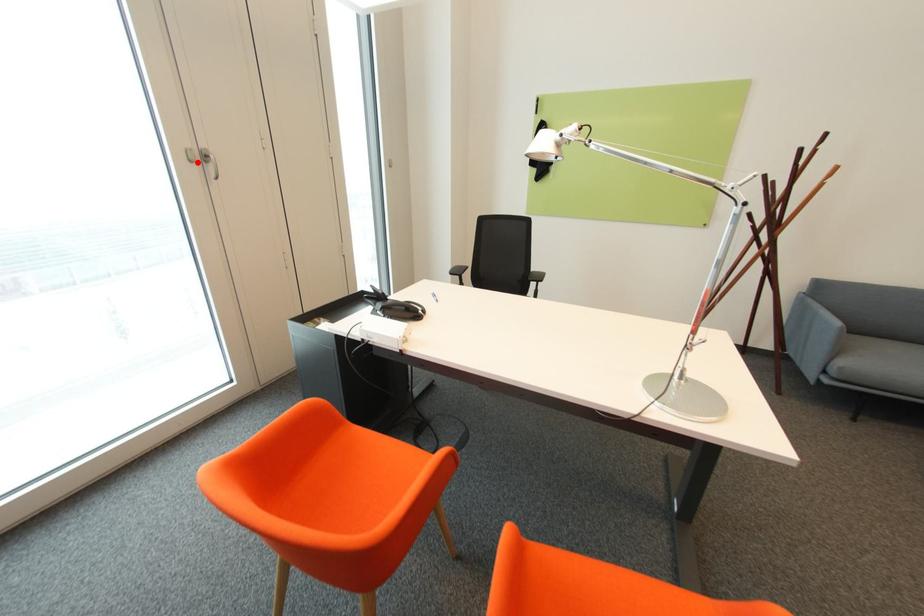
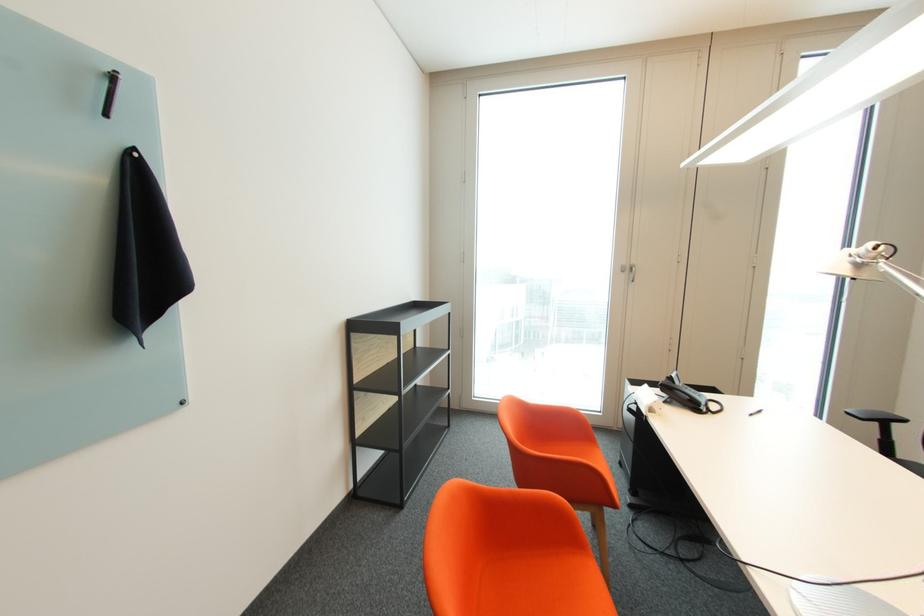
The point at the highlighted location is marked in the first image. Where is the corresponding point in the second image?

(629, 272)